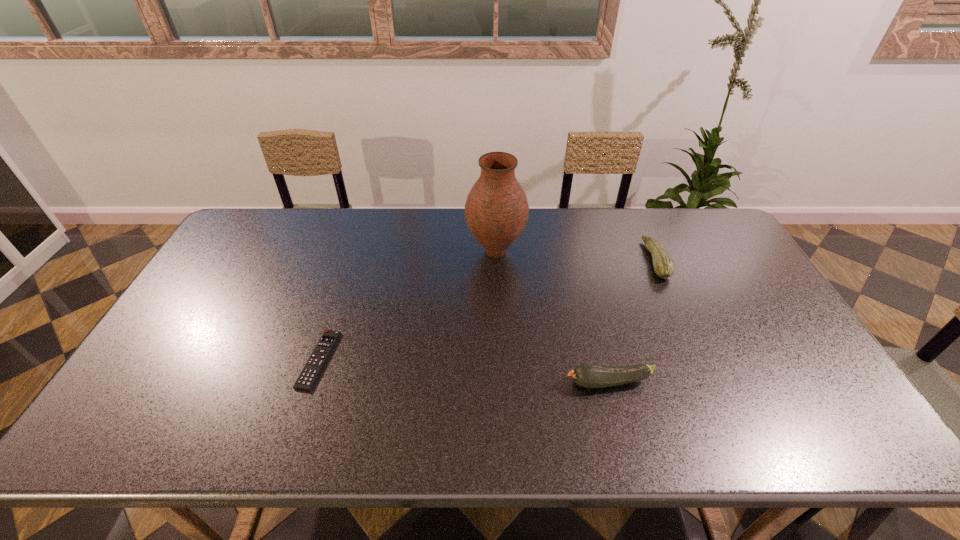
In order to click on empty space between the shortest object and the vase in this screenshot , I will do `click(407, 306)`.

Where is `free spot between the shortest object and the right zucchini`? free spot between the shortest object and the right zucchini is located at coordinates (488, 310).

At what (x,y) coordinates should I click in order to perform the action: click on free space between the farther zucchini and the remote control. Please return your answer as a coordinate pair (x, y). The image size is (960, 540). Looking at the image, I should click on (488, 310).

Select which object appears as the second closest to the shortest object. Please provide its 2D coordinates. Your answer should be formatted as a tuple, i.e. [(x, y)], where the tuple contains the x and y coordinates of a point satisfying the conditions above.

[(586, 375)]

Identify which object is located as the third nearest to the remote control. Please provide its 2D coordinates. Your answer should be formatted as a tuple, i.e. [(x, y)], where the tuple contains the x and y coordinates of a point satisfying the conditions above.

[(664, 267)]